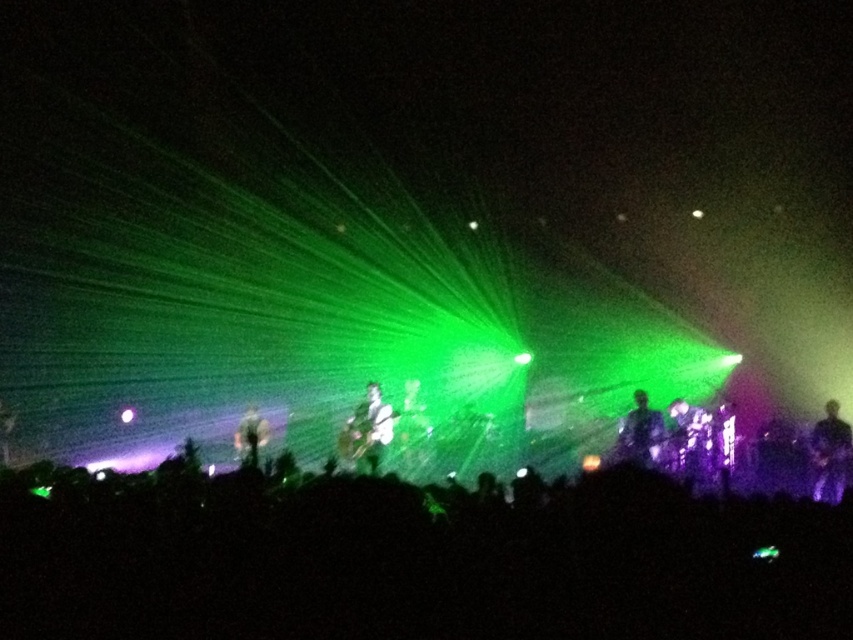
Question: Is metallic silver guitar at center to the right of shiny black guitar at center from the viewer's perspective?

Choices:
 (A) no
 (B) yes

Answer: (A)

Question: Which object is positioned farthest from the shiny black guitar at center?

Choices:
 (A) metallic silver guitar at center
 (B) black matte crowd at lower center

Answer: (B)

Question: Does black glossy guitar at right appear over matte white guitar at center?

Choices:
 (A) no
 (B) yes

Answer: (A)

Question: Does shiny black guitar at center have a larger size compared to matte white guitar at center?

Choices:
 (A) yes
 (B) no

Answer: (B)

Question: Which object appears closest to the camera in this image?

Choices:
 (A) black matte crowd at lower center
 (B) black glossy guitar at right
 (C) matte white guitar at center
 (D) shiny black guitar at center

Answer: (A)

Question: Which point is closer to the camera?

Choices:
 (A) metallic silver guitar at center
 (B) black glossy guitar at right
 (C) matte white guitar at center

Answer: (C)